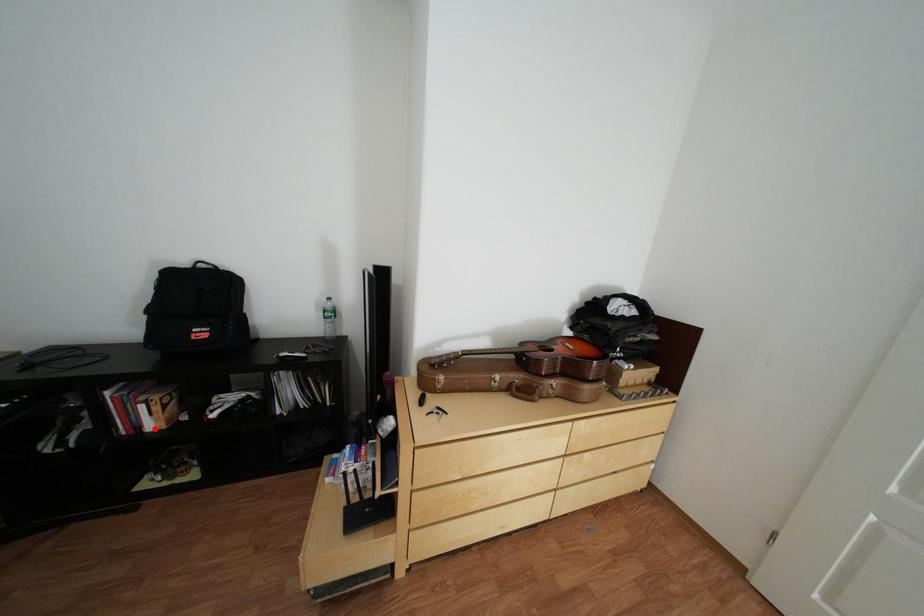
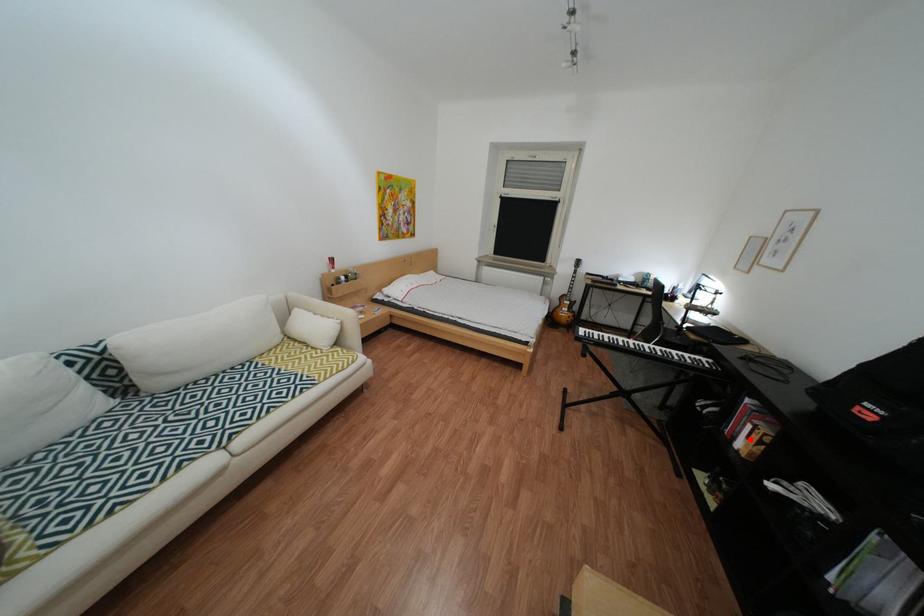
I am providing you with two images of the same scene from different viewpoints. A red point is marked on the first image and another point is marked on the second image. Is the marked point in image1 the same physical position as the marked point in image2?

Yes